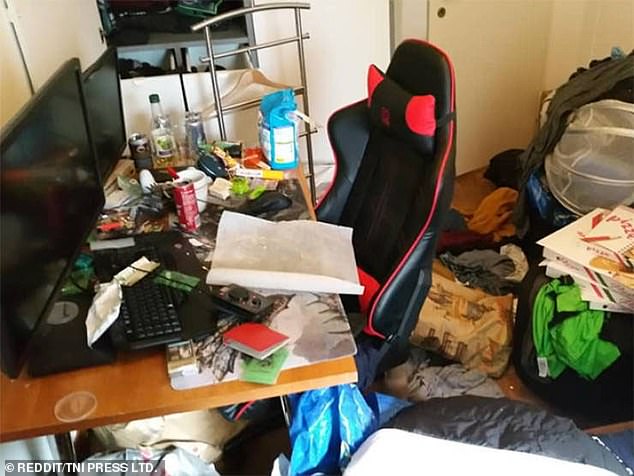
Locate an element on the screen. computer chair is located at coordinates (385, 156).